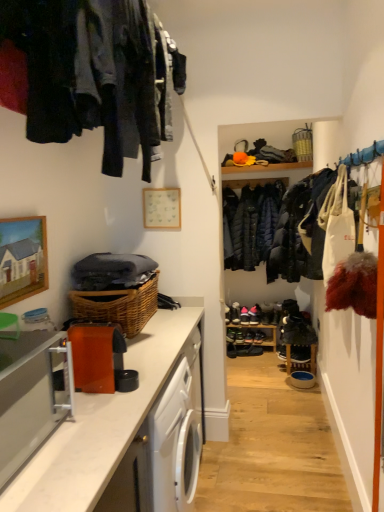
At what (x,y) coordinates should I click in order to perform the action: click on dark gray fabric at upper left, the first clothing viewed from the left. Please return your answer as a coordinate pair (x, y). This screenshot has height=512, width=384. Looking at the image, I should click on (91, 74).

What is the approximate height of white matte picture frame at upper center, the second picture frame from the bottom?

white matte picture frame at upper center, the second picture frame from the bottom, is 11.05 inches tall.

I want to click on black leather shoe at center, arranged as the first shoe when viewed from the top, so click(235, 313).

Identify the location of satin silver toaster at left. The height and width of the screenshot is (512, 384). (29, 398).

Consider the image. What is the approximate height of shiny black shoe at center, which is the 4th shoe from top to bottom?

shiny black shoe at center, which is the 4th shoe from top to bottom, is 5.01 inches in height.

I want to click on shiny black shoe at center, which is counted as the 2th shoe, starting from the bottom, so click(x=249, y=336).

Locate an element on the screen. This screenshot has height=512, width=384. cabinetry on the left of shiny black shoe at center, marked as the 3th shoe in a top-to-bottom arrangement is located at coordinates (29, 398).

Is shiny black shoe at center, marked as the 3th shoe in a top-to-bottom arrangement, placed right next to satin silver toaster at left?

shiny black shoe at center, marked as the 3th shoe in a top-to-bottom arrangement, and satin silver toaster at left are clearly separated.

Does point (247, 312) come behind point (40, 365)?

That is True.

Considering the relative positions of shiny black shoe at center, marked as the fourth shoe in a bottom-to-top arrangement, and black leather shoe at center, arranged as the first shoe when viewed from the top, in the image provided, is shiny black shoe at center, marked as the fourth shoe in a bottom-to-top arrangement, to the left of black leather shoe at center, arranged as the first shoe when viewed from the top, from the viewer's perspective?

No, shiny black shoe at center, marked as the fourth shoe in a bottom-to-top arrangement, is not to the left of black leather shoe at center, arranged as the first shoe when viewed from the top.

At what (x,y) coordinates should I click in order to perform the action: click on the 2nd shoe behind the shiny black shoe at center, marked as the 3th shoe in a top-to-bottom arrangement. Please return your answer as a coordinate pair (x, y). This screenshot has width=384, height=512. Looking at the image, I should click on (235, 313).

Measure the distance between shiny black shoe at center, marked as the fourth shoe in a bottom-to-top arrangement, and black leather shoe at center, arranged as the sixth shoe when ordered from the bottom.

shiny black shoe at center, marked as the fourth shoe in a bottom-to-top arrangement, is 3.08 inches away from black leather shoe at center, arranged as the sixth shoe when ordered from the bottom.

Is point (244, 320) closer or farther from the camera than point (238, 310)?

Point (244, 320).

Considering the relative sizes of shiny black shoe at center, positioned as the third shoe in bottom-to-top order, and satin silver toaster at left in the image provided, is shiny black shoe at center, positioned as the third shoe in bottom-to-top order, smaller than satin silver toaster at left?

Yes, shiny black shoe at center, positioned as the third shoe in bottom-to-top order, is smaller than satin silver toaster at left.

From a real-world perspective, is shiny black shoe at center, positioned as the third shoe in bottom-to-top order, physically located above or below satin silver toaster at left?

From a real-world perspective, shiny black shoe at center, positioned as the third shoe in bottom-to-top order, is physically below satin silver toaster at left.

Considering the sizes of objects shiny black shoe at center, positioned as the third shoe in bottom-to-top order, and satin silver toaster at left in the image provided, who is taller, shiny black shoe at center, positioned as the third shoe in bottom-to-top order, or satin silver toaster at left?

Standing taller between the two is satin silver toaster at left.

Are shiny black shoe at center, positioned as the third shoe in bottom-to-top order, and satin silver toaster at left beside each other?

No, shiny black shoe at center, positioned as the third shoe in bottom-to-top order, is not in contact with satin silver toaster at left.

Between satin silver toaster at left and woven brown basket at lower left, positioned as the 1th basket in bottom-to-top order, which one appears on the left side from the viewer's perspective?

satin silver toaster at left.

Starting from the satin silver toaster at left, which basket is the 1st one to the right? Please provide its 2D coordinates.

[(118, 306)]

Is satin silver toaster at left positioned far away from woven brown basket at lower left, the 2th basket in the right-to-left sequence?

satin silver toaster at left is near woven brown basket at lower left, the 2th basket in the right-to-left sequence, not far away.

Is white matte picture frame at upper center, the 1th picture frame when ordered from back to front, positioned beyond the bounds of woven brown basket at lower left, which ranks as the 2th basket in top-to-bottom order?

white matte picture frame at upper center, the 1th picture frame when ordered from back to front, lies outside woven brown basket at lower left, which ranks as the 2th basket in top-to-bottom order,'s area.

From the image's perspective, is white matte picture frame at upper center, acting as the 1th picture frame starting from the right, positioned above or below woven brown basket at lower left, which appears as the second basket when viewed from the back?

white matte picture frame at upper center, acting as the 1th picture frame starting from the right, is situated higher than woven brown basket at lower left, which appears as the second basket when viewed from the back, in the image.

Is white matte picture frame at upper center, positioned as the 1th picture frame in top-to-bottom order, bigger or smaller than woven brown basket at lower left, which appears as the second basket when viewed from the back?

white matte picture frame at upper center, positioned as the 1th picture frame in top-to-bottom order, is smaller than woven brown basket at lower left, which appears as the second basket when viewed from the back.

Image resolution: width=384 pixels, height=512 pixels. In order to click on picture frame that is on the right side of woven brown basket at lower left, the 2th basket in the right-to-left sequence in this screenshot , I will do `click(162, 208)`.

From a real-world perspective, does white matte picture frame at upper center, the 2th picture frame from the left, stand above shiny black shoe at center, marked as the 5th shoe in a top-to-bottom arrangement?

Yes.

Which is in front, point (150, 224) or point (246, 342)?

Point (150, 224)

Is white matte picture frame at upper center, the 2th picture frame from the left, taller or shorter than shiny black shoe at center, marked as the 5th shoe in a top-to-bottom arrangement?

Considering their sizes, white matte picture frame at upper center, the 2th picture frame from the left, has more height than shiny black shoe at center, marked as the 5th shoe in a top-to-bottom arrangement.

From a real-world perspective, is dark gray fabric at upper left, acting as the 2th clothing starting from the back, positioned under satin silver toaster at left based on gravity?

Incorrect, from a real-world perspective, dark gray fabric at upper left, acting as the 2th clothing starting from the back, is higher than satin silver toaster at left.

Is dark gray fabric at upper left, marked as the 2th clothing in a right-to-left arrangement, in contact with satin silver toaster at left?

No, dark gray fabric at upper left, marked as the 2th clothing in a right-to-left arrangement, is not beside satin silver toaster at left.

Does dark gray fabric at upper left, marked as the 1th clothing in a front-to-back arrangement, turn towards satin silver toaster at left?

No, dark gray fabric at upper left, marked as the 1th clothing in a front-to-back arrangement, is not facing towards satin silver toaster at left.

Based on their sizes in the image, would you say dark gray fabric at upper left, marked as the 2th clothing in a right-to-left arrangement, is bigger or smaller than satin silver toaster at left?

Clearly, dark gray fabric at upper left, marked as the 2th clothing in a right-to-left arrangement, is larger in size than satin silver toaster at left.

Where is `shoe that is the 3rd object to the right of the satin silver toaster at left, starting at the anchor`? This screenshot has width=384, height=512. shoe that is the 3rd object to the right of the satin silver toaster at left, starting at the anchor is located at coordinates click(x=244, y=316).

At what (x,y) coordinates should I click in order to perform the action: click on shoe that is the 2nd object located above the shiny black shoe at center, marked as the 3th shoe in a top-to-bottom arrangement (from the image's perspective). Please return your answer as a coordinate pair (x, y). Looking at the image, I should click on (235, 313).

Considering their positions, is shiny black shoe at center, the sixth shoe from the top, positioned closer to black leather shoes at center than wooden woven basket at upper right, the first basket from the right?

shiny black shoe at center, the sixth shoe from the top, lies closer to black leather shoes at center than the other object.

When comparing their distances from white marble countertop at lower left, does wooden picture frame at upper left, the first picture frame from the front, or shiny black shoe at center, which is counted as the 2th shoe, starting from the bottom, seem closer?

Among the two, wooden picture frame at upper left, the first picture frame from the front, is located nearer to white marble countertop at lower left.

Which object lies nearer to the anchor point shiny black shoe at center, marked as the fourth shoe in a bottom-to-top arrangement, dark gray fabric at upper left, marked as the 2th clothing in a right-to-left arrangement, or wooden picture frame at upper left, the second picture frame in the back-to-front sequence?

wooden picture frame at upper left, the second picture frame in the back-to-front sequence, is closer to shiny black shoe at center, marked as the fourth shoe in a bottom-to-top arrangement.

Looking at this image, based on their spatial positions, is black leather shoe at center, arranged as the first shoe when viewed from the top, or shiny black shoe at center, which is counted as the 2th shoe, starting from the bottom, closer to shiny black shoe at center, the 2th shoe in the top-to-bottom sequence?

Based on the image, shiny black shoe at center, which is counted as the 2th shoe, starting from the bottom, appears to be nearer to shiny black shoe at center, the 2th shoe in the top-to-bottom sequence.

Based on their spatial positions, is satin silver toaster at left or wooden picture frame at upper left, which appears as the 2th picture frame when viewed from the right, closer to dark gray fabric at upper left, marked as the 2th clothing in a right-to-left arrangement?

Among the two, wooden picture frame at upper left, which appears as the 2th picture frame when viewed from the right, is located nearer to dark gray fabric at upper left, marked as the 2th clothing in a right-to-left arrangement.

When comparing their distances from shiny black shoe at center, marked as the fourth shoe in a bottom-to-top arrangement, does satin silver toaster at left or dark gray fabric at upper left, the first clothing viewed from the left, seem closer?

Among the two, dark gray fabric at upper left, the first clothing viewed from the left, is located nearer to shiny black shoe at center, marked as the fourth shoe in a bottom-to-top arrangement.

Which object lies nearer to the anchor point wooden picture frame at upper left, acting as the 2th picture frame starting from the top, white matte picture frame at upper center, the 1th picture frame when ordered from back to front, or woven brown basket at lower left, which appears as the second basket when viewed from the back?

woven brown basket at lower left, which appears as the second basket when viewed from the back, is closer to wooden picture frame at upper left, acting as the 2th picture frame starting from the top.

Considering their positions, is wooden shoe rack at center positioned further to black leather shoes at center than black leather shoe at center, arranged as the first shoe when viewed from the top?

The object further to black leather shoes at center is black leather shoe at center, arranged as the first shoe when viewed from the top.

Identify the location of clothing between dark gray fabric at upper left, marked as the 1th clothing in a front-to-back arrangement, and wooden shoe rack at center, along the z-axis. (250, 224).

Locate an element on the screen. The image size is (384, 512). footwear located between satin silver toaster at left and shiny black shoe at center, acting as the 5th shoe starting from the bottom, in the depth direction is located at coordinates (243, 350).

Identify the location of footwear positioned between dark gray fabric at upper left, marked as the 2th clothing in a right-to-left arrangement, and shiny black shoe at center, acting as the 5th shoe starting from the bottom, from near to far. This screenshot has width=384, height=512. (243, 350).

Find the location of `shelf between wooden woven basket at upper right, the second basket from the front, and shiny black shoe at center, the first shoe positioned from the bottom, in the up-down direction`. shelf between wooden woven basket at upper right, the second basket from the front, and shiny black shoe at center, the first shoe positioned from the bottom, in the up-down direction is located at coordinates (261, 328).